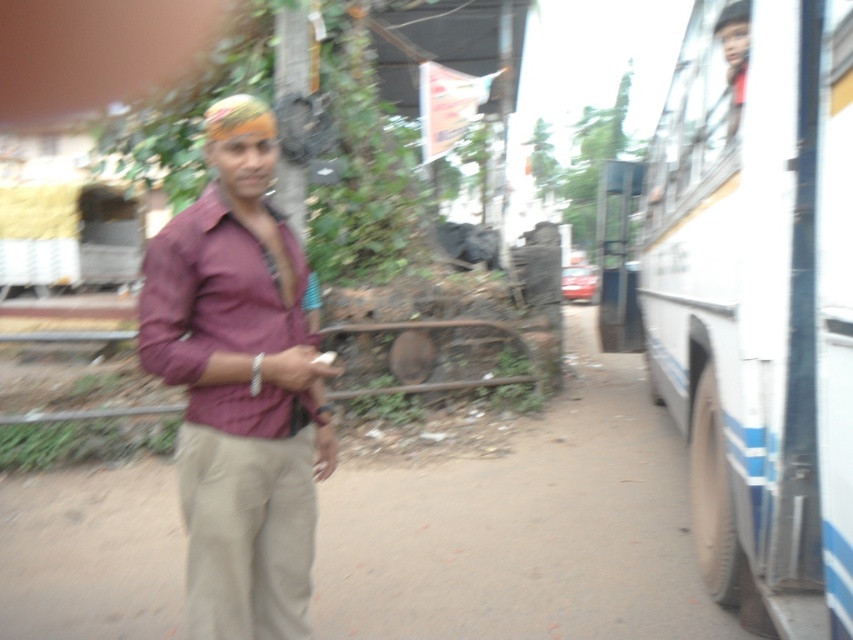
Question: Does white matte bus at right appear under khaki pants at center?

Choices:
 (A) no
 (B) yes

Answer: (A)

Question: Can you confirm if white matte bus at right is positioned above khaki pants at center?

Choices:
 (A) yes
 (B) no

Answer: (A)

Question: Among these objects, which one is nearest to the camera?

Choices:
 (A) white matte bus at right
 (B) khaki pants at center

Answer: (A)

Question: Is white matte bus at right to the right of khaki pants at center from the viewer's perspective?

Choices:
 (A) no
 (B) yes

Answer: (B)